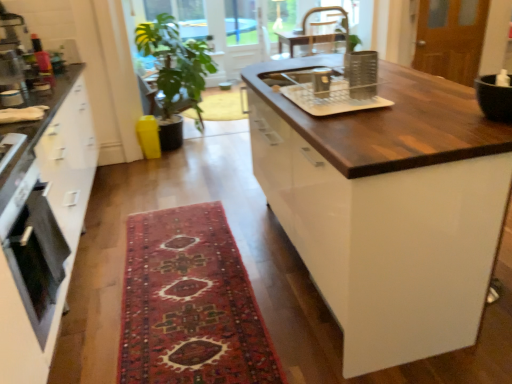
Question: Is clear plastic dish rack at center, the third appliance positioned from the left, bigger or smaller than green leafy plant at center?

Choices:
 (A) big
 (B) small

Answer: (B)

Question: Is point [x=361, y=105] positioned closer to the camera than point [x=181, y=97]?

Choices:
 (A) farther
 (B) closer

Answer: (B)

Question: Considering the real-world distances, which object is closest to the matte black oven at left?

Choices:
 (A) green leafy plant at upper center
 (B) carpeted rug at center
 (C) wooden screen door at upper right
 (D) metallic silver toaster at left, which appears as the first appliance when viewed from the back
 (E) green leafy plant at center

Answer: (B)

Question: Which object is the closest to the metallic silver chair at upper center?

Choices:
 (A) carpeted rug at center
 (B) metallic silver toaster at left, which is the 4th appliance in front-to-back order
 (C) matte black oven at left
 (D) clear plastic dish rack at center, positioned as the 3th appliance in back-to-front order
 (E) green leafy plant at center

Answer: (E)